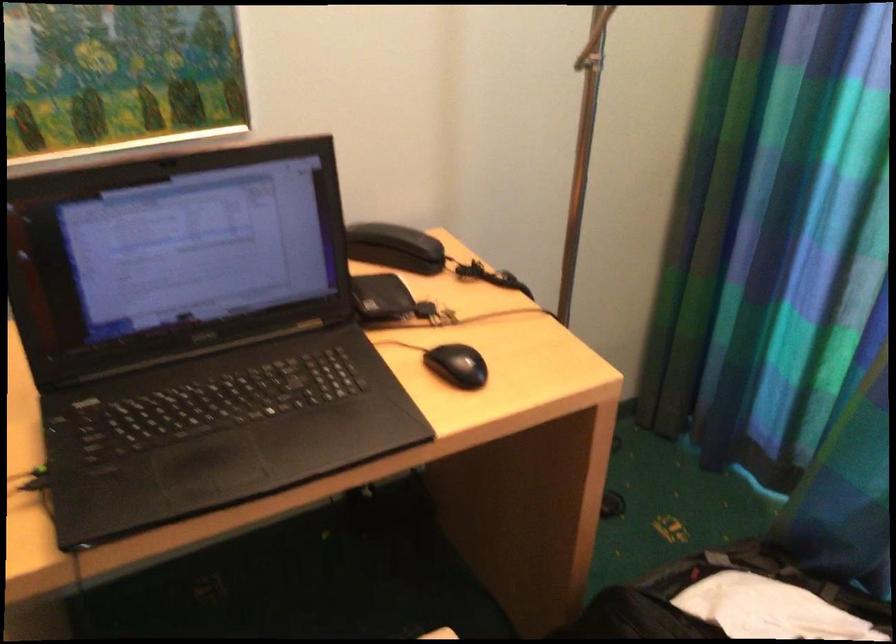
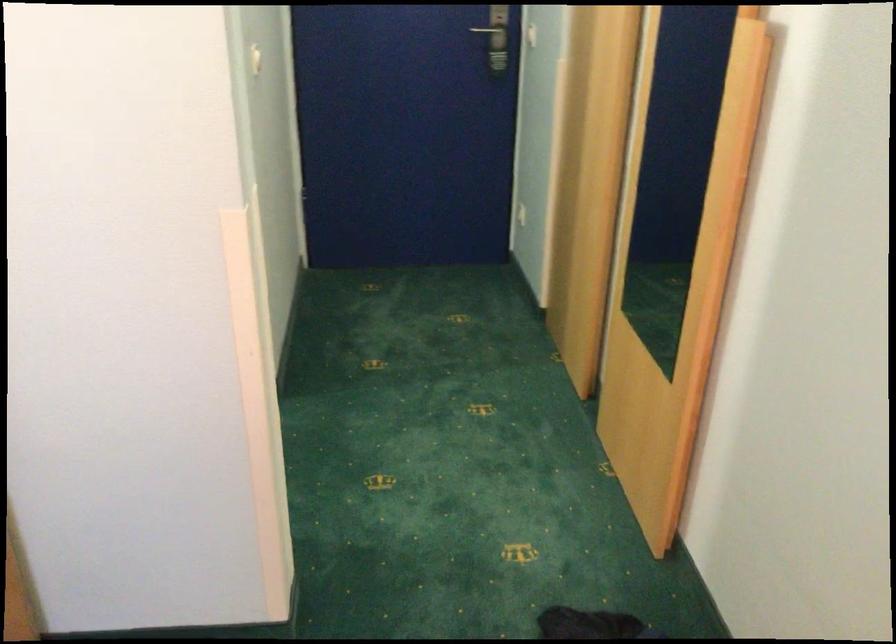
The images are taken continuously from a first-person perspective. In which direction is your viewpoint rotating?

The camera rotated toward left-down.